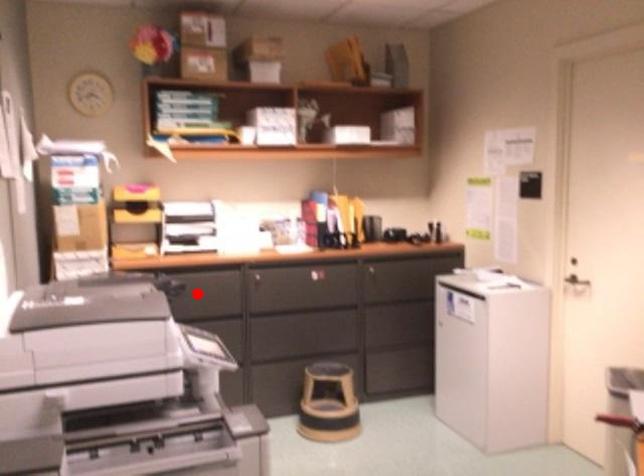
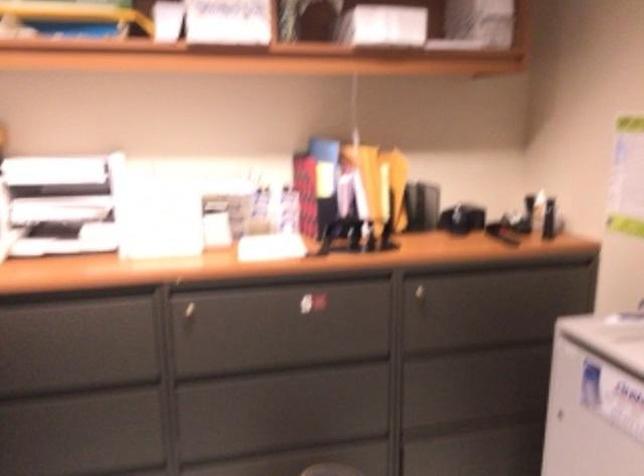
Question: I am providing you with two images of the same scene from different viewpoints. Image1 has a red point marked. In image2, the corresponding 3D location appears at what relative position? Reply with the corresponding letter.

Choices:
 (A) Closer
 (B) Farther

Answer: (A)